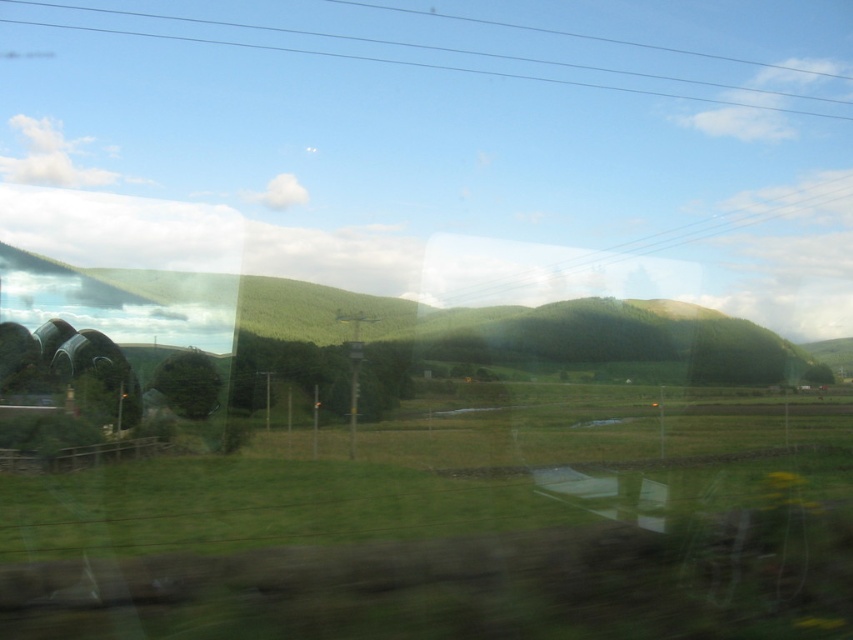
Question: Can you confirm if green grassy field at center is positioned to the left of green matte tree at center?

Choices:
 (A) yes
 (B) no

Answer: (B)

Question: Which of the following is the farthest from the observer?

Choices:
 (A) (108, 8)
 (B) (83, 301)

Answer: (A)

Question: Considering the real-world distances, which object is closest to the green matte tree at center?

Choices:
 (A) green grassy field at center
 (B) green grassy hill at center

Answer: (A)

Question: Which of the following is the farthest from the observer?

Choices:
 (A) green matte tree at center
 (B) green grassy field at center

Answer: (A)

Question: Considering the relative positions of green grassy hill at center and green matte tree at center in the image provided, where is green grassy hill at center located with respect to green matte tree at center?

Choices:
 (A) left
 (B) right

Answer: (B)

Question: Is green grassy field at center positioned in front of green grassy hill at center?

Choices:
 (A) no
 (B) yes

Answer: (B)